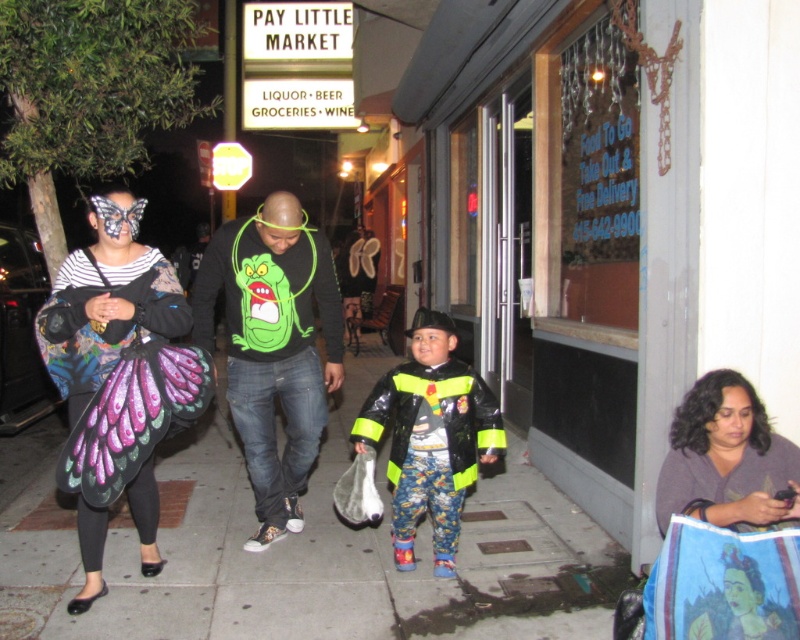
Does smooth concrete sidewalk at center have a lesser width compared to reflective black jacket at center?

In fact, smooth concrete sidewalk at center might be wider than reflective black jacket at center.

What do you see at coordinates (312, 556) in the screenshot?
I see `smooth concrete sidewalk at center` at bounding box center [312, 556].

Where is `smooth concrete sidewalk at center`? smooth concrete sidewalk at center is located at coordinates (312, 556).

The width and height of the screenshot is (800, 640). Describe the element at coordinates (312, 556) in the screenshot. I see `smooth concrete sidewalk at center` at that location.

The width and height of the screenshot is (800, 640). Find the location of `smooth concrete sidewalk at center`. smooth concrete sidewalk at center is located at coordinates (312, 556).

Which is more to the right, black matte sweatshirt at center or reflective black jacket at center?

reflective black jacket at center is more to the right.

Is black matte sweatshirt at center above reflective black jacket at center?

Yes, black matte sweatshirt at center is above reflective black jacket at center.

At what (x,y) coordinates should I click in order to perform the action: click on black matte sweatshirt at center. Please return your answer as a coordinate pair (x, y). The width and height of the screenshot is (800, 640). Looking at the image, I should click on tap(274, 352).

This screenshot has width=800, height=640. Find the location of `black matte sweatshirt at center`. black matte sweatshirt at center is located at coordinates (274, 352).